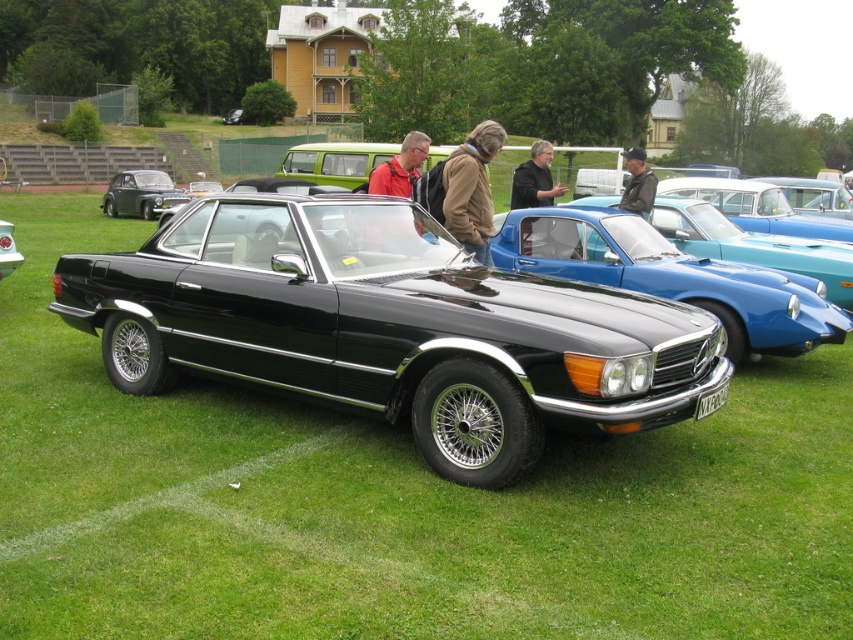
Question: Can you confirm if brown leather jacket at center is positioned to the left of shiny black car at center?

Choices:
 (A) yes
 (B) no

Answer: (B)

Question: Which object is farther from the camera taking this photo?

Choices:
 (A) black metallic car at center
 (B) brown leather jacket at center

Answer: (B)

Question: Which point is closer to the camera?

Choices:
 (A) black metallic car at center
 (B) shiny black car at left

Answer: (A)

Question: Considering the relative positions of black metallic car at center and shiny black car at left in the image provided, where is black metallic car at center located with respect to shiny black car at left?

Choices:
 (A) above
 (B) below

Answer: (B)

Question: Which point appears farthest from the camera in this image?

Choices:
 (A) (142, 208)
 (B) (469, 163)
 (C) (0, 259)

Answer: (A)

Question: Does brown leather jacket at center have a greater width compared to shiny black car at left?

Choices:
 (A) yes
 (B) no

Answer: (B)